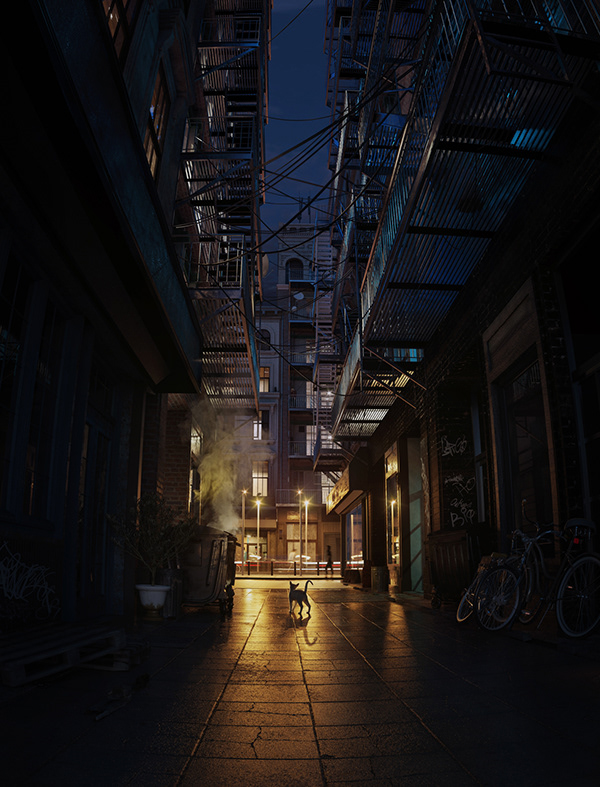
The width and height of the screenshot is (600, 787). What are the coordinates of `doors` in the screenshot? It's located at (290, 527), (353, 529), (395, 529).